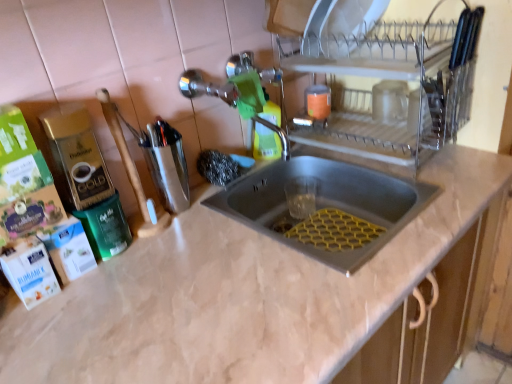
Find the location of `beige marble countertop at center`. beige marble countertop at center is located at coordinates (237, 297).

What do you see at coordinates (390, 78) in the screenshot?
I see `clear glass dish rack at upper right, the first appliance viewed from the right` at bounding box center [390, 78].

Find the location of a particular element. Image resolution: width=512 pixels, height=384 pixels. beige marble countertop at center is located at coordinates (237, 297).

In terms of width, does beige marble countertop at center look wider or thinner when compared to metallic silver utensil holder at center-left, placed as the first appliance when sorted from left to right?

In the image, beige marble countertop at center appears to be wider than metallic silver utensil holder at center-left, placed as the first appliance when sorted from left to right.

Which object is further away from the camera taking this photo, beige marble countertop at center or metallic silver utensil holder at center-left, placed as the first appliance when sorted from left to right?

Positioned behind is metallic silver utensil holder at center-left, placed as the first appliance when sorted from left to right.

Is point (210, 373) closer or farther from the camera than point (180, 140)?

Point (210, 373).

Where is `countertop on the right of metallic silver utensil holder at center-left, placed as the first appliance when sorted from left to right`? The height and width of the screenshot is (384, 512). countertop on the right of metallic silver utensil holder at center-left, placed as the first appliance when sorted from left to right is located at coordinates (237, 297).

Is there a large distance between clear glass dish rack at upper right, which is the 2th appliance from left to right, and metallic silver utensil holder at center-left, placed as the first appliance when sorted from left to right?

That's not correct — clear glass dish rack at upper right, which is the 2th appliance from left to right, is a little close to metallic silver utensil holder at center-left, placed as the first appliance when sorted from left to right.

From the image's perspective, would you say clear glass dish rack at upper right, which is the 2th appliance from left to right, is positioned over metallic silver utensil holder at center-left, placed as the first appliance when sorted from left to right?

Yes, from the image's perspective, clear glass dish rack at upper right, which is the 2th appliance from left to right, is above metallic silver utensil holder at center-left, placed as the first appliance when sorted from left to right.

Is clear glass dish rack at upper right, which is the 2th appliance from left to right, to the left or to the right of metallic silver utensil holder at center-left, acting as the second appliance starting from the right, in the image?

Based on their positions, clear glass dish rack at upper right, which is the 2th appliance from left to right, is located to the right of metallic silver utensil holder at center-left, acting as the second appliance starting from the right.

Find the location of `appliance that appears behind the clear glass dish rack at upper right, the first appliance viewed from the right`. appliance that appears behind the clear glass dish rack at upper right, the first appliance viewed from the right is located at coordinates (167, 164).

Is point (275, 155) farther from viewer compared to point (244, 181)?

Yes, it is.

From a real-world perspective, is green matte bottle at center positioned above or below stainless steel sink at center?

From a real-world perspective, green matte bottle at center is physically above stainless steel sink at center.

Can you confirm if green matte bottle at center is positioned to the left of stainless steel sink at center?

Indeed, green matte bottle at center is positioned on the left side of stainless steel sink at center.

From the picture: Is clear glass dish rack at upper right, the first appliance viewed from the right, at the back of metallic silver utensil holder at center-left, placed as the first appliance when sorted from left to right?

No, metallic silver utensil holder at center-left, placed as the first appliance when sorted from left to right, is not facing the opposite direction of clear glass dish rack at upper right, the first appliance viewed from the right.

From the image's perspective, is metallic silver utensil holder at center-left, placed as the first appliance when sorted from left to right, beneath clear glass dish rack at upper right, the first appliance viewed from the right?

Correct, metallic silver utensil holder at center-left, placed as the first appliance when sorted from left to right, appears lower than clear glass dish rack at upper right, the first appliance viewed from the right, in the image.

Considering the sizes of metallic silver utensil holder at center-left, placed as the first appliance when sorted from left to right, and clear glass dish rack at upper right, which is the 2th appliance from left to right, in the image, is metallic silver utensil holder at center-left, placed as the first appliance when sorted from left to right, wider or thinner than clear glass dish rack at upper right, which is the 2th appliance from left to right,?

In the image, metallic silver utensil holder at center-left, placed as the first appliance when sorted from left to right, appears to be more narrow than clear glass dish rack at upper right, which is the 2th appliance from left to right.

Is metallic silver utensil holder at center-left, acting as the second appliance starting from the right, inside the boundaries of clear glass dish rack at upper right, which is the 2th appliance from left to right, or outside?

metallic silver utensil holder at center-left, acting as the second appliance starting from the right, is not enclosed by clear glass dish rack at upper right, which is the 2th appliance from left to right.

Is metallic silver utensil holder at center-left, acting as the second appliance starting from the right, turned away from green matte bottle at center?

No, metallic silver utensil holder at center-left, acting as the second appliance starting from the right, is not facing the opposite direction of green matte bottle at center.

Does point (179, 208) lie behind point (265, 140)?

No, (179, 208) is in front of (265, 140).

Considering the sizes of objects metallic silver utensil holder at center-left, acting as the second appliance starting from the right, and green matte bottle at center in the image provided, who is thinner, metallic silver utensil holder at center-left, acting as the second appliance starting from the right, or green matte bottle at center?

Thinner between the two is green matte bottle at center.

How distant is metallic silver utensil holder at center-left, acting as the second appliance starting from the right, from green matte bottle at center?

metallic silver utensil holder at center-left, acting as the second appliance starting from the right, and green matte bottle at center are 10.80 inches apart from each other.

Can you confirm if stainless steel sink at center is thinner than beige marble countertop at center?

Indeed, stainless steel sink at center has a lesser width compared to beige marble countertop at center.

Locate an element on the screen. sink that appears behind the beige marble countertop at center is located at coordinates (326, 208).

Visually, is stainless steel sink at center positioned to the left or to the right of beige marble countertop at center?

From the image, it's evident that stainless steel sink at center is to the left of beige marble countertop at center.

Which object is positioned more to the left, green matte bottle at center or beige marble countertop at center?

green matte bottle at center is more to the left.

Is green matte bottle at center inside the boundaries of beige marble countertop at center, or outside?

green matte bottle at center is not enclosed by beige marble countertop at center.

Find the location of a particular element. countertop on the right of metallic silver utensil holder at center-left, acting as the second appliance starting from the right is located at coordinates (237, 297).

The width and height of the screenshot is (512, 384). Identify the location of appliance behind the clear glass dish rack at upper right, which is the 2th appliance from left to right. (167, 164).

When comparing their distances from stainless steel sink at center, does beige marble countertop at center or green matte bottle at center seem further?

green matte bottle at center is further to stainless steel sink at center.

Based on their spatial positions, is metallic silver utensil holder at center-left, acting as the second appliance starting from the right, or beige marble countertop at center further from stainless steel sink at center?

The object further to stainless steel sink at center is metallic silver utensil holder at center-left, acting as the second appliance starting from the right.

Based on the photo, which object lies further to the anchor point metallic silver utensil holder at center-left, acting as the second appliance starting from the right, green matte bottle at center or stainless steel sink at center?

Among the two, stainless steel sink at center is located further to metallic silver utensil holder at center-left, acting as the second appliance starting from the right.

Which object lies further to the anchor point metallic silver utensil holder at center-left, acting as the second appliance starting from the right, clear glass dish rack at upper right, the first appliance viewed from the right, or stainless steel sink at center?

clear glass dish rack at upper right, the first appliance viewed from the right, is positioned further to the anchor metallic silver utensil holder at center-left, acting as the second appliance starting from the right.

Estimate the real-world distances between objects in this image. Which object is further from metallic silver utensil holder at center-left, acting as the second appliance starting from the right, beige marble countertop at center or green matte bottle at center?

Based on the image, beige marble countertop at center appears to be further to metallic silver utensil holder at center-left, acting as the second appliance starting from the right.

Based on their spatial positions, is metallic silver utensil holder at center-left, acting as the second appliance starting from the right, or green matte bottle at center further from stainless steel sink at center?

The object further to stainless steel sink at center is metallic silver utensil holder at center-left, acting as the second appliance starting from the right.

When comparing their distances from green matte bottle at center, does clear glass dish rack at upper right, which is the 2th appliance from left to right, or metallic silver utensil holder at center-left, acting as the second appliance starting from the right, seem further?

The object further to green matte bottle at center is clear glass dish rack at upper right, which is the 2th appliance from left to right.

Based on their spatial positions, is stainless steel sink at center or green matte bottle at center closer to beige marble countertop at center?

stainless steel sink at center.

You are a GUI agent. You are given a task and a screenshot of the screen. Output one action in this format:
    pyautogui.click(x=<x>, y=<y>)
    Task: Click on the appliance between green matte bottle at center and beige marble countertop at center from top to bottom
    Image resolution: width=512 pixels, height=384 pixels.
    Given the screenshot: What is the action you would take?
    pyautogui.click(x=167, y=164)

I want to click on appliance between clear glass dish rack at upper right, which is the 2th appliance from left to right, and beige marble countertop at center from top to bottom, so click(167, 164).

Locate an element on the screen. The height and width of the screenshot is (384, 512). cleaning product between clear glass dish rack at upper right, which is the 2th appliance from left to right, and beige marble countertop at center from top to bottom is located at coordinates 266,142.

Where is `sink that lies between green matte bottle at center and beige marble countertop at center from top to bottom`? The width and height of the screenshot is (512, 384). sink that lies between green matte bottle at center and beige marble countertop at center from top to bottom is located at coordinates (326, 208).